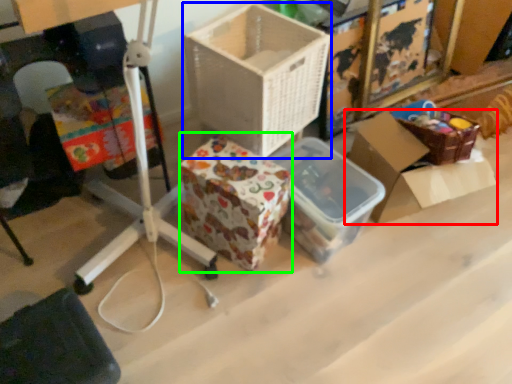
Question: Considering the real-world distances, which object is closest to box (highlighted by a red box)? box (highlighted by a blue box) or storage box (highlighted by a green box).

Choices:
 (A) box
 (B) storage box

Answer: (A)